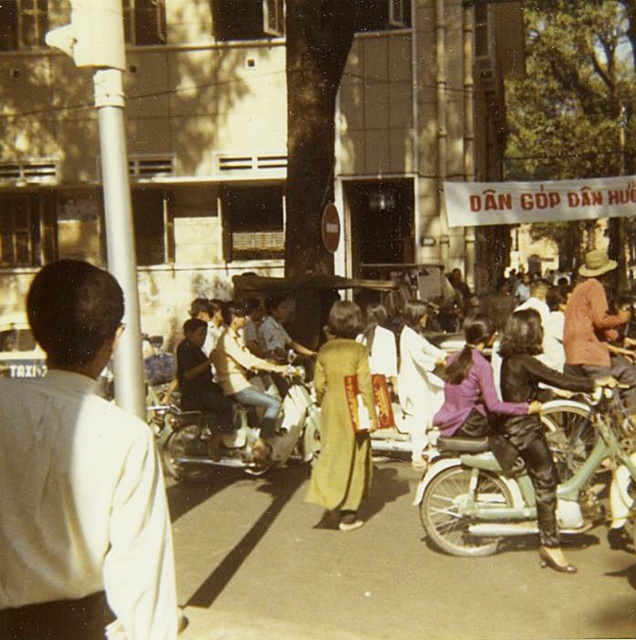
Question: Which point is closer to the camera taking this photo?

Choices:
 (A) (155, 518)
 (B) (504, 371)

Answer: (A)

Question: Which object is farther from the camera taking this photo?

Choices:
 (A) white shirt at left
 (B) white matte motorcycle at center
 (C) light green metallic motorcycle at center-right

Answer: (B)

Question: Does white shirt at left have a larger size compared to white matte motorcycle at center?

Choices:
 (A) yes
 (B) no

Answer: (B)

Question: Is white shirt at left bigger than yellow silk ao dai at center?

Choices:
 (A) no
 (B) yes

Answer: (A)

Question: Can you confirm if white shirt at left is positioned to the left of white matte motorcycle at center?

Choices:
 (A) yes
 (B) no

Answer: (B)

Question: Which object appears closest to the camera in this image?

Choices:
 (A) white shirt at left
 (B) white matte motorcycle at center
 (C) leather pants at center

Answer: (A)